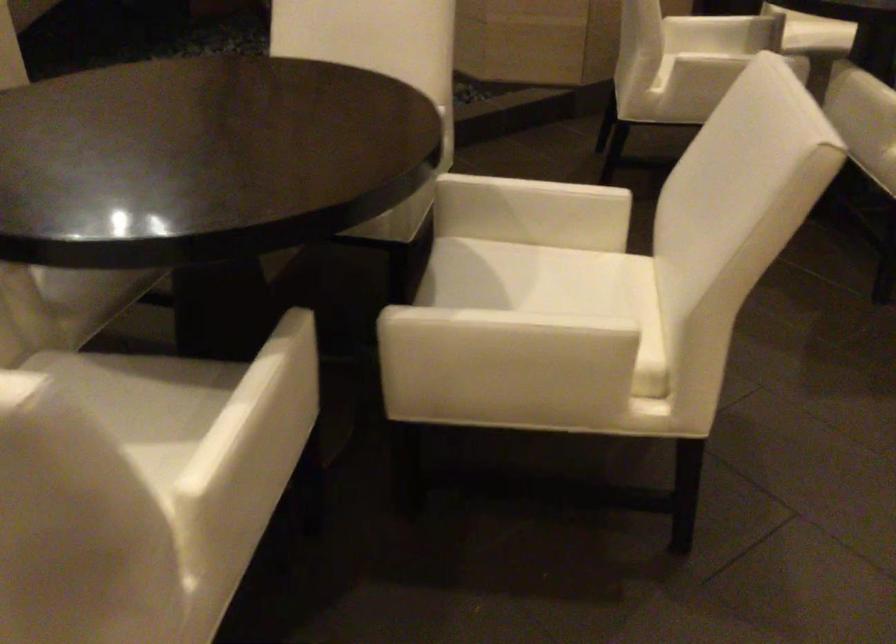
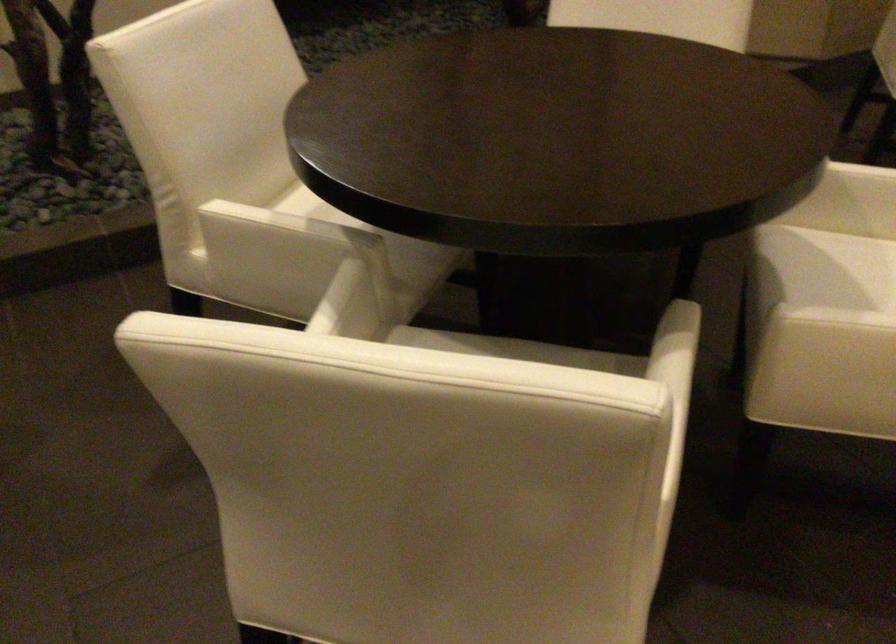
Where in the second image is the point corresponding to point (497, 272) from the first image?

(855, 266)